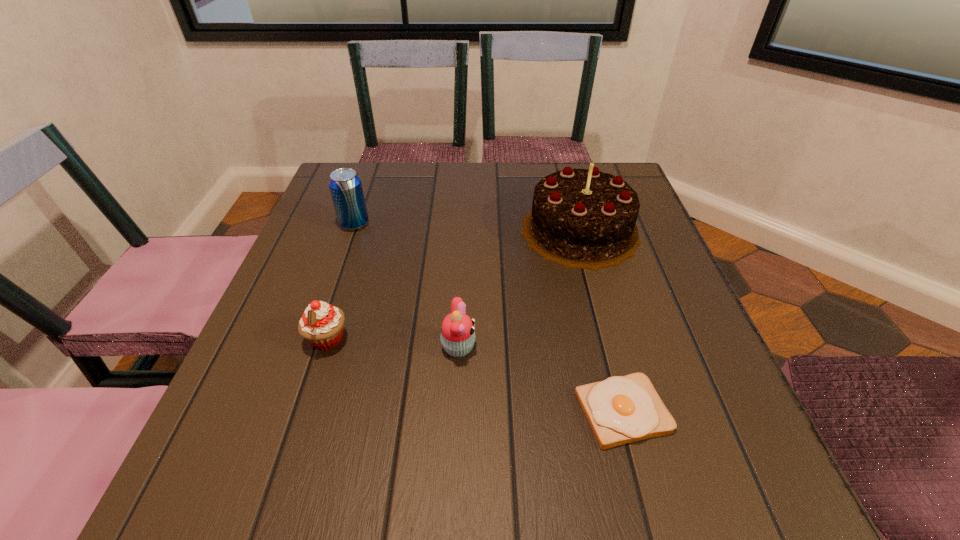
The height and width of the screenshot is (540, 960). In order to click on free point that satisfies the following two spatial constraints: 1. on the front side of the fourth shortest object; 2. on the left side of the shortest object in this screenshot , I will do pos(289,411).